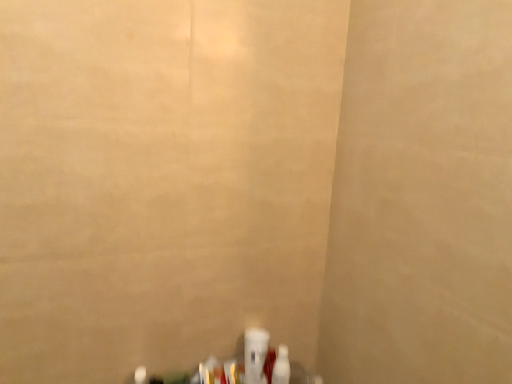
What do you see at coordinates (255, 355) in the screenshot?
I see `white plastic toothbrush at center` at bounding box center [255, 355].

The image size is (512, 384). In order to click on white plastic toothbrush at center in this screenshot , I will do `click(255, 355)`.

Locate an element on the screen. The height and width of the screenshot is (384, 512). white plastic toothbrush at center is located at coordinates (255, 355).